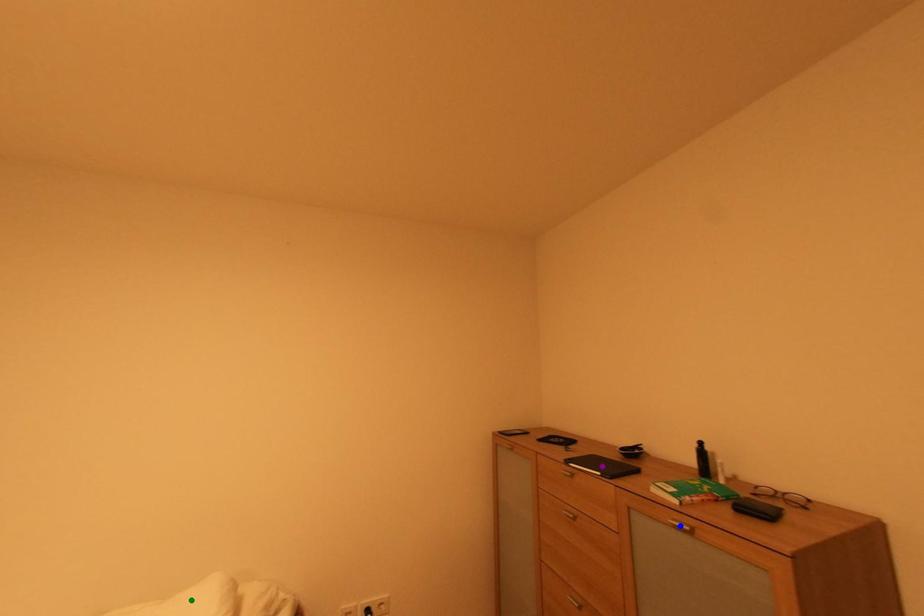
Order these from nearest to farthest:
blue point, purple point, green point

purple point < green point < blue point